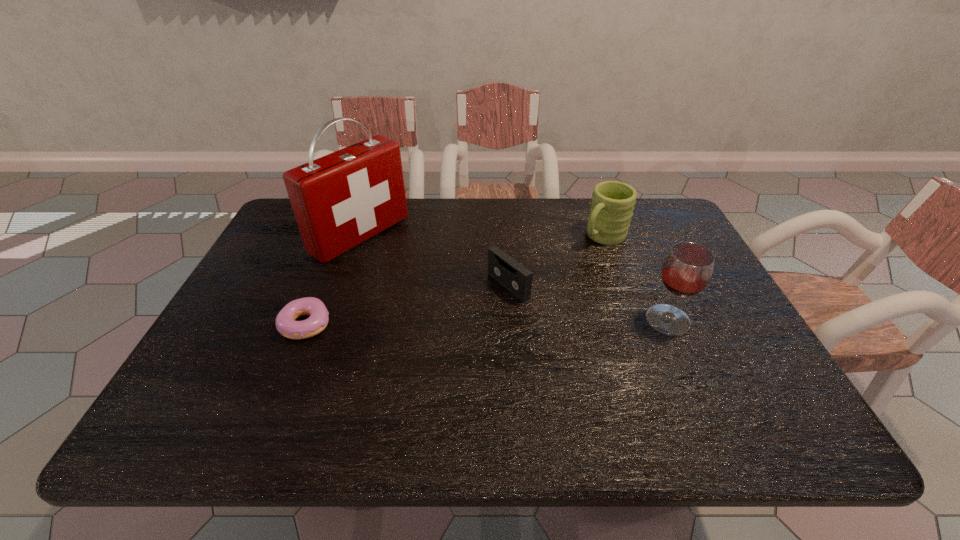
Find the location of a particular element. This screenshot has height=540, width=960. vacant space situated 0.190m on the side of the third shortest object with the handle is located at coordinates (550, 279).

What are the coordinates of `free point located 0.270m on the front face of the tallest object` in the screenshot? It's located at (460, 298).

Identify the location of vacant space located 0.180m on the front face of the tallest object. (434, 282).

The height and width of the screenshot is (540, 960). What are the coordinates of `free space located 0.110m on the front face of the tallest object` in the screenshot? It's located at (416, 271).

Identify the location of free space located on the front-facing side of the third farthest object. (405, 346).

Locate an element on the screen. blank space located on the front-facing side of the third farthest object is located at coordinates (423, 335).

Identify the location of vacant space situated on the front-facing side of the third farthest object. This screenshot has height=540, width=960. (373, 364).

The image size is (960, 540). I want to click on mug at the far edge, so click(x=612, y=204).

Where is `the first-aid kit at the far edge`? the first-aid kit at the far edge is located at coordinates (340, 200).

This screenshot has width=960, height=540. I want to click on doughnut that is at the left edge, so click(x=285, y=322).